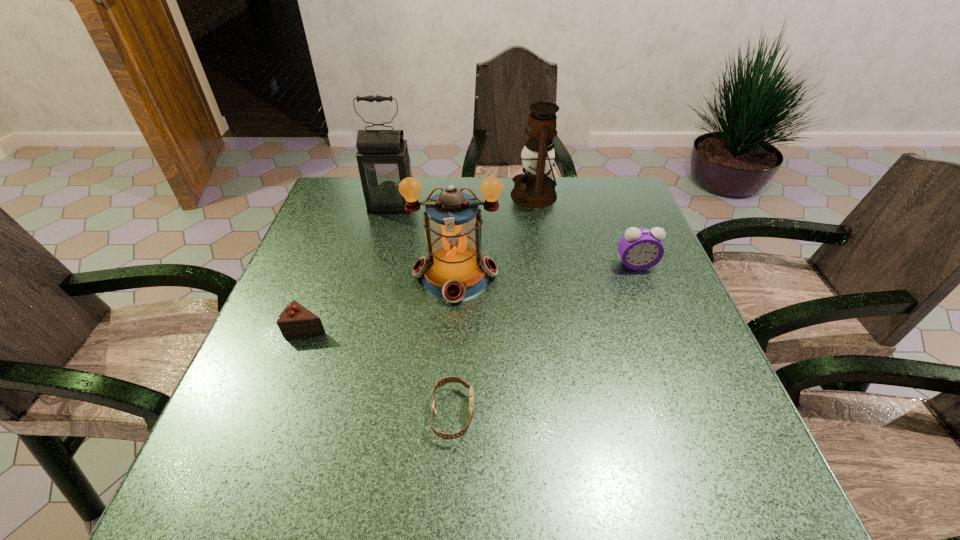
Image resolution: width=960 pixels, height=540 pixels. I want to click on vacant space located 0.140m on the side of the fifth object from left to right, there is a wick adjustment knob, so click(x=464, y=195).

Where is `vacant space situated on the side of the fifth object from left to right, there is a wick adjustment knob`? vacant space situated on the side of the fifth object from left to right, there is a wick adjustment knob is located at coordinates (401, 195).

Where is `free spot located 0.170m on the side of the fifth object from left to right, there is a wick adjustment knob`? The width and height of the screenshot is (960, 540). free spot located 0.170m on the side of the fifth object from left to right, there is a wick adjustment knob is located at coordinates (454, 195).

Where is `free space located on the front-facing side of the leftmost lantern`? Image resolution: width=960 pixels, height=540 pixels. free space located on the front-facing side of the leftmost lantern is located at coordinates (373, 272).

Identify the location of vacant space located on the front-facing side of the third tallest object. (447, 415).

Where is `free space located on the face of the fourth tallest object`? This screenshot has width=960, height=540. free space located on the face of the fourth tallest object is located at coordinates (685, 392).

Identify the location of vacant space located on the right of the fifth tallest object. (444, 327).

Where is `vacant space situated 0.250m on the face of the nearest object`? This screenshot has height=540, width=960. vacant space situated 0.250m on the face of the nearest object is located at coordinates (612, 414).

Find the location of `lantern located in the left edge section of the desktop`. lantern located in the left edge section of the desktop is located at coordinates (383, 160).

What are the coordinates of `chocolate cake that is at the left edge` in the screenshot? It's located at (295, 320).